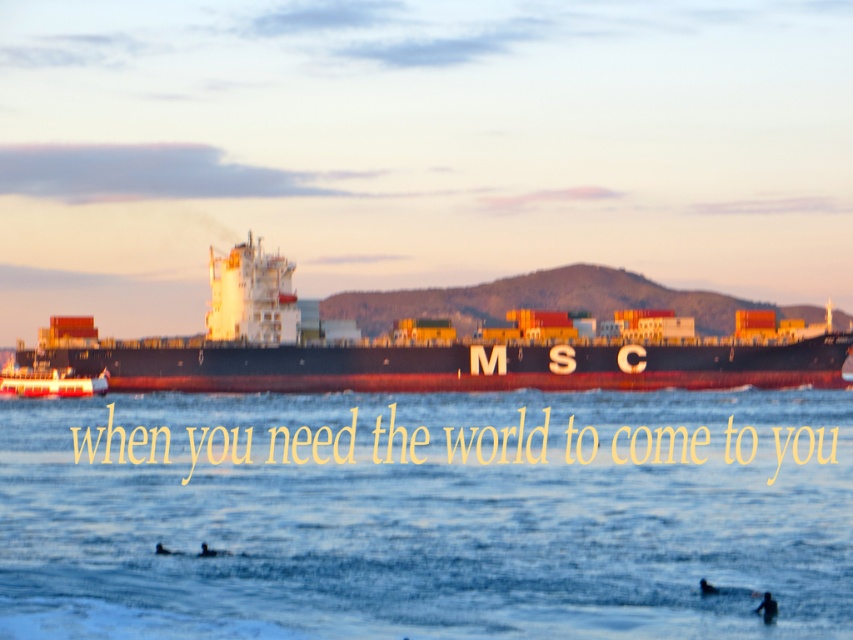
Question: Which point is closer to the camera?

Choices:
 (A) blue water at center
 (B) black matte cargo ship at center

Answer: (A)

Question: Among these objects, which one is farthest from the camera?

Choices:
 (A) metallic red boat at left
 (B) blue water at center
 (C) black matte cargo ship at center

Answer: (A)

Question: Is blue water at center wider than metallic red boat at left?

Choices:
 (A) yes
 (B) no

Answer: (A)

Question: Can you confirm if blue water at center is smaller than metallic red boat at left?

Choices:
 (A) no
 (B) yes

Answer: (A)

Question: Is blue water at center to the left of black matte cargo ship at center from the viewer's perspective?

Choices:
 (A) no
 (B) yes

Answer: (B)

Question: Which of the following is the farthest from the observer?

Choices:
 (A) black matte cargo ship at center
 (B) metallic red boat at left

Answer: (B)